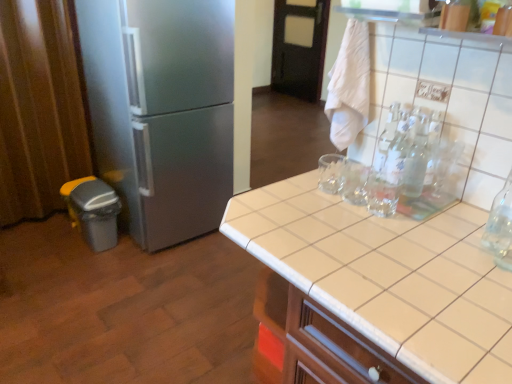
Question: From the image's perspective, is white tile countertop at center located above or below black wood door at upper center?

Choices:
 (A) above
 (B) below

Answer: (B)

Question: From a real-world perspective, relative to black wood door at upper center, is white tile countertop at center vertically above or below?

Choices:
 (A) above
 (B) below

Answer: (B)

Question: Estimate the real-world distances between objects in this image. Which object is farther from the brown fabric curtain at left?

Choices:
 (A) white tile countertop at center
 (B) black wood door at upper center
 (C) satin silver refrigerator at left
 (D) clear glass bottle at upper right

Answer: (B)

Question: Based on their relative distances, which object is nearer to the satin silver refrigerator at left?

Choices:
 (A) black wood door at upper center
 (B) clear glass bottle at upper right
 (C) brown fabric curtain at left
 (D) white tile countertop at center

Answer: (C)